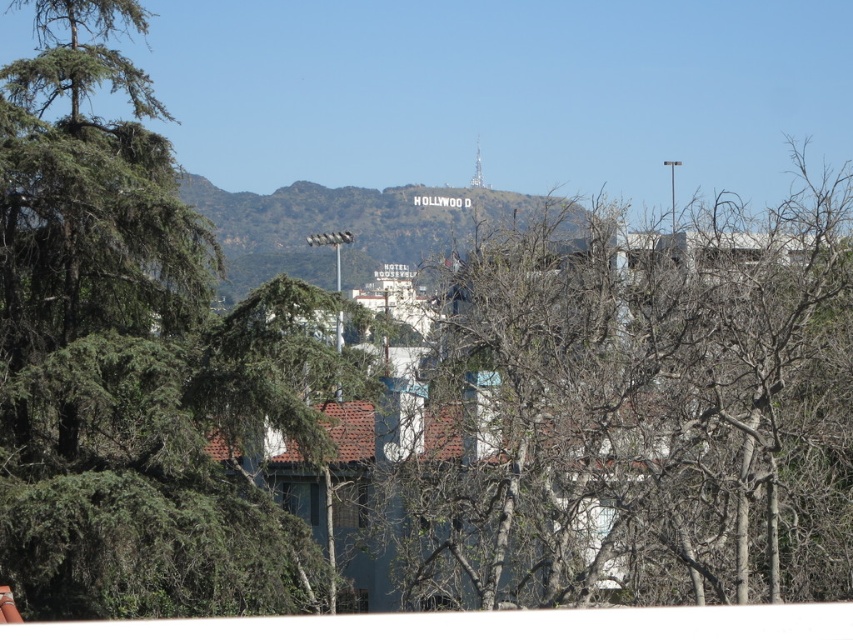
Does bare branches at center have a larger size compared to white stone hollywood sign at center?

Correct, bare branches at center is larger in size than white stone hollywood sign at center.

Can you confirm if bare branches at center is positioned to the right of white stone hollywood sign at center?

Correct, you'll find bare branches at center to the right of white stone hollywood sign at center.

Locate an element on the screen. This screenshot has height=640, width=853. bare branches at center is located at coordinates (643, 416).

What are the coordinates of `bare branches at center` in the screenshot? It's located at (643, 416).

Which of these two, bare branches at center or green leafy tree at left, stands shorter?

Standing shorter between the two is bare branches at center.

Does bare branches at center have a larger size compared to green leafy tree at left?

Yes, bare branches at center is bigger than green leafy tree at left.

Identify the location of bare branches at center. (643, 416).

Is green leafy tree at left below white stone hollywood sign at center?

Correct, green leafy tree at left is located below white stone hollywood sign at center.

Does green leafy tree at left have a larger size compared to white stone hollywood sign at center?

Indeed, green leafy tree at left has a larger size compared to white stone hollywood sign at center.

Image resolution: width=853 pixels, height=640 pixels. What do you see at coordinates (136, 362) in the screenshot?
I see `green leafy tree at left` at bounding box center [136, 362].

In order to click on green leafy tree at left in this screenshot , I will do `click(136, 362)`.